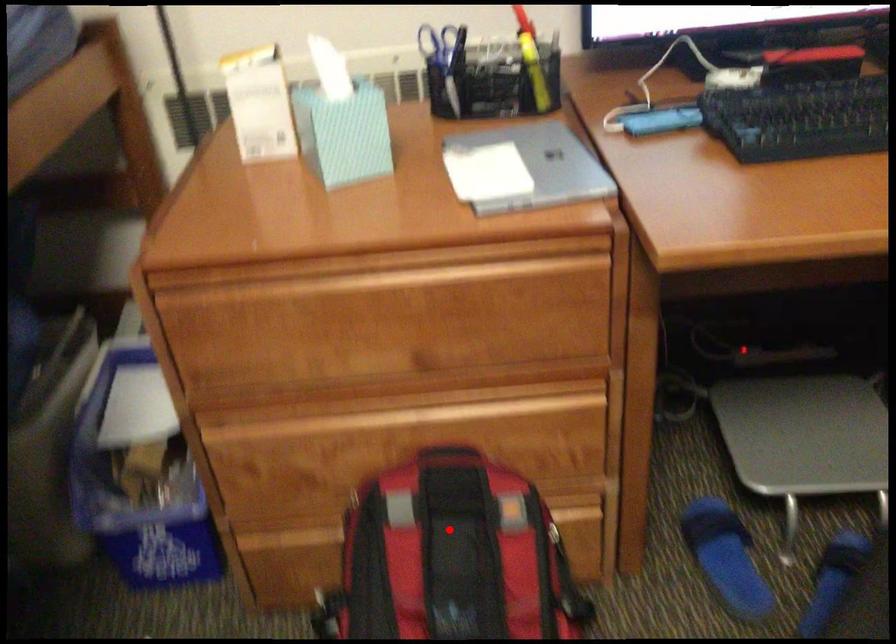
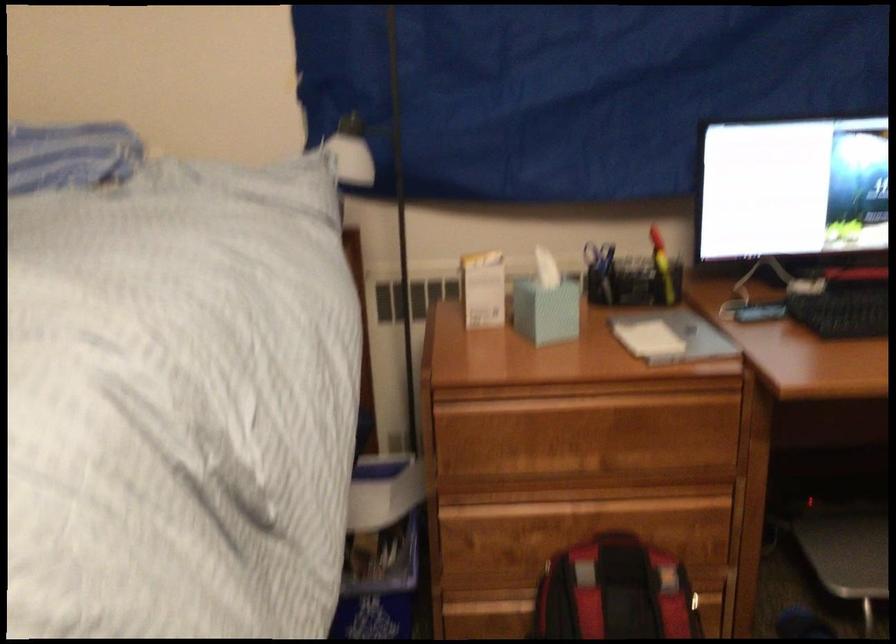
The point at the highlighted location is marked in the first image. Where is the corresponding point in the second image?

(615, 592)